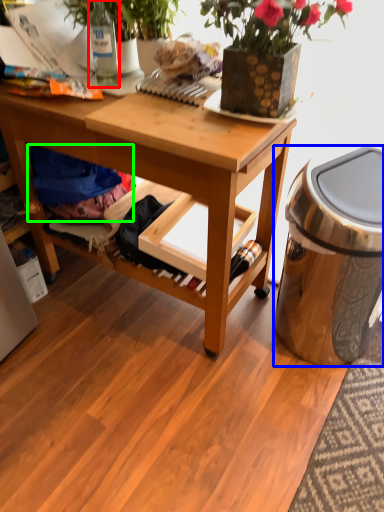
Question: Based on their relative distances, which object is nearer to bottle (highlighted by a red box)? Choose from trash bin/can (highlighted by a blue box) and clothing (highlighted by a green box).

Choices:
 (A) trash bin/can
 (B) clothing

Answer: (B)